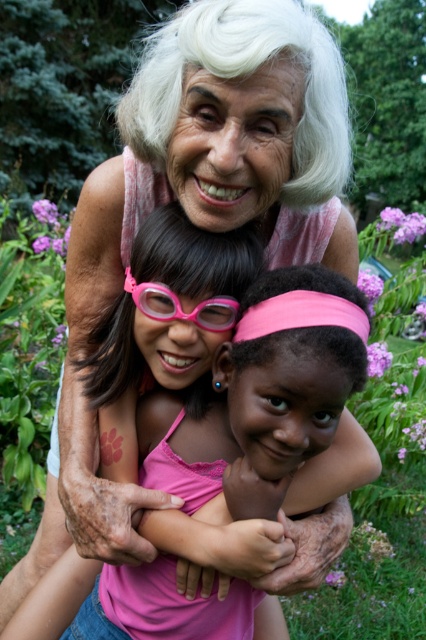
Between pink fabric at center and pink rubber goggles at center, which one has less height?

pink rubber goggles at center

Is pink fabric at center further to the viewer compared to pink rubber goggles at center?

No, it is in front of pink rubber goggles at center.

Who is more forward, (310, 316) or (157, 282)?

Point (310, 316) is in front.

Identify the location of pink fabric at center. The image size is (426, 640). (261, 396).